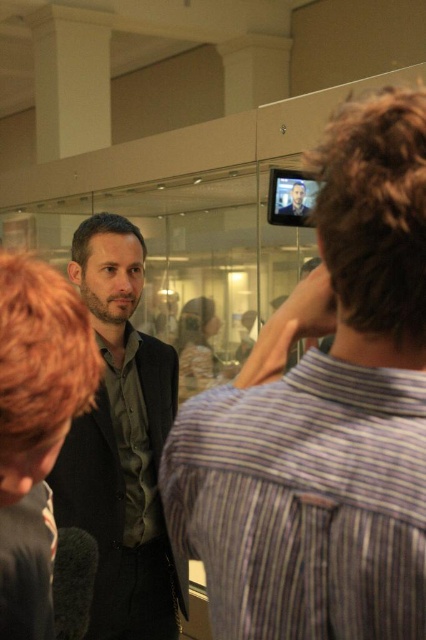
Who is taller, black plastic video camera at upper center or matte black face at center?

black plastic video camera at upper center

Does point (284, 179) come closer to viewer compared to point (298, 212)?

No, it is not.

Which is behind, point (271, 214) or point (305, 209)?

The point (271, 214) is behind.

You are a GUI agent. You are given a task and a screenshot of the screen. Output one action in this format:
    pyautogui.click(x=<x>, y=<y>)
    Task: Click on the black plastic video camera at upper center
    
    Given the screenshot: What is the action you would take?
    pyautogui.click(x=290, y=196)

Which is behind, point (374, 394) or point (131, 300)?

Point (131, 300)

At what (x,y) coordinates should I click in order to perform the action: click on matte black shirt at left. Please return your answer as a coordinate pair (x, y). Looking at the image, I should click on (324, 416).

Identify the location of matte black shirt at left. The width and height of the screenshot is (426, 640). (324, 416).

Is point (100, 240) less distant than point (293, 188)?

Yes, it is.

Describe the element at coordinates (121, 444) in the screenshot. I see `dark gray suit at center` at that location.

Does point (103, 364) lie in front of point (299, 189)?

Yes, point (103, 364) is in front of point (299, 189).

Where is `dark gray suit at center`? The image size is (426, 640). dark gray suit at center is located at coordinates (121, 444).